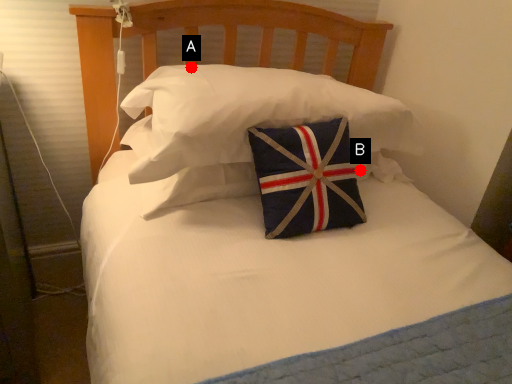
Question: Two points are circled on the image, labeled by A and B beside each circle. Which point is further to the camera?

Choices:
 (A) A is further
 (B) B is further

Answer: (B)